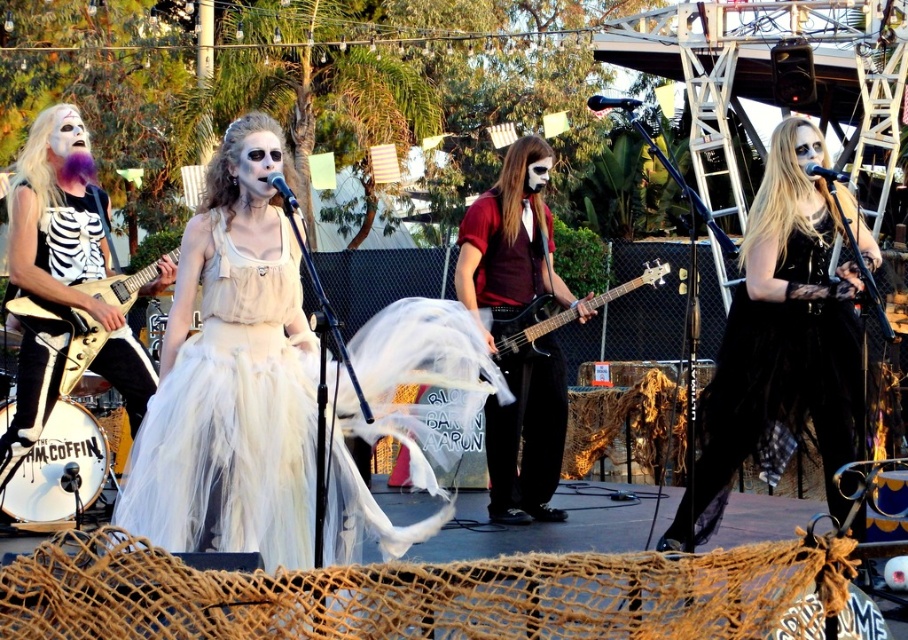
Question: Is matte red shirt at center bigger than black matte bass guitar at center?

Choices:
 (A) yes
 (B) no

Answer: (A)

Question: Where is matte white dress at center located in relation to metallic gold electric guitar at left in the image?

Choices:
 (A) below
 (B) above

Answer: (A)

Question: Which object is positioned closest to the matte white dress at center?

Choices:
 (A) matte red shirt at center
 (B) black matte bass guitar at center

Answer: (A)

Question: Which point is farther from the camera taking this photo?

Choices:
 (A) (32, 316)
 (B) (810, 364)
 (C) (664, 273)
 (D) (492, 492)

Answer: (D)

Question: Which object is closer to the camera taking this photo?

Choices:
 (A) matte white dress at center
 (B) black velvet dress at right
 (C) metallic gold electric guitar at left

Answer: (A)

Question: Does matte white dress at center have a smaller size compared to black velvet dress at right?

Choices:
 (A) yes
 (B) no

Answer: (B)